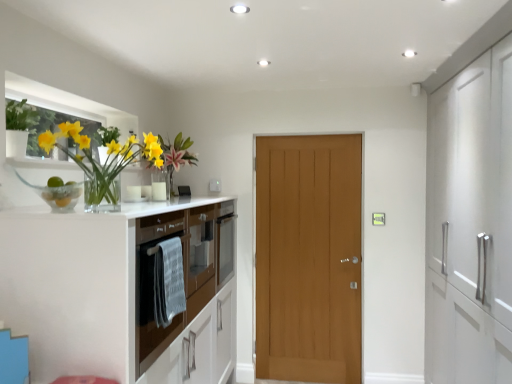
Question: From the image's perspective, is translucent glass vase at left on top of green matte plant at upper left?

Choices:
 (A) yes
 (B) no

Answer: (B)

Question: Is translucent glass vase at left completely or partially outside of green matte plant at upper left?

Choices:
 (A) no
 (B) yes

Answer: (B)

Question: Is translucent glass vase at left positioned far away from green matte plant at upper left?

Choices:
 (A) no
 (B) yes

Answer: (A)

Question: From a real-world perspective, is translucent glass vase at left under green matte plant at upper left?

Choices:
 (A) yes
 (B) no

Answer: (A)

Question: Can you confirm if translucent glass vase at left is thinner than green matte plant at upper left?

Choices:
 (A) no
 (B) yes

Answer: (A)

Question: Is translucent glass vase at left positioned before green matte plant at upper left?

Choices:
 (A) no
 (B) yes

Answer: (B)

Question: Is translucent glass vase at left wider than brown glossy oven at left?

Choices:
 (A) no
 (B) yes

Answer: (A)

Question: From the image's perspective, does translucent glass vase at left appear lower than brown glossy oven at left?

Choices:
 (A) no
 (B) yes

Answer: (A)

Question: Can you confirm if translucent glass vase at left is positioned to the right of brown glossy oven at left?

Choices:
 (A) no
 (B) yes

Answer: (A)

Question: Considering the relative positions of translucent glass vase at left and brown glossy oven at left in the image provided, is translucent glass vase at left to the left of brown glossy oven at left from the viewer's perspective?

Choices:
 (A) no
 (B) yes

Answer: (B)

Question: Is translucent glass vase at left oriented away from brown glossy oven at left?

Choices:
 (A) yes
 (B) no

Answer: (B)

Question: Is translucent glass vase at left further to camera compared to brown glossy oven at left?

Choices:
 (A) yes
 (B) no

Answer: (B)

Question: Is brown glossy oven at left positioned with its back to translucent glass vase at left?

Choices:
 (A) yes
 (B) no

Answer: (B)